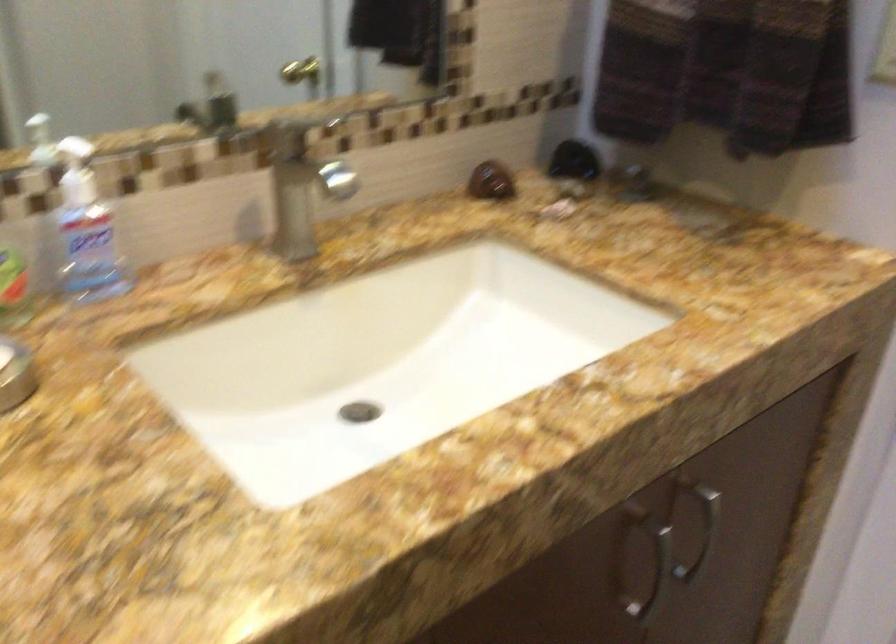
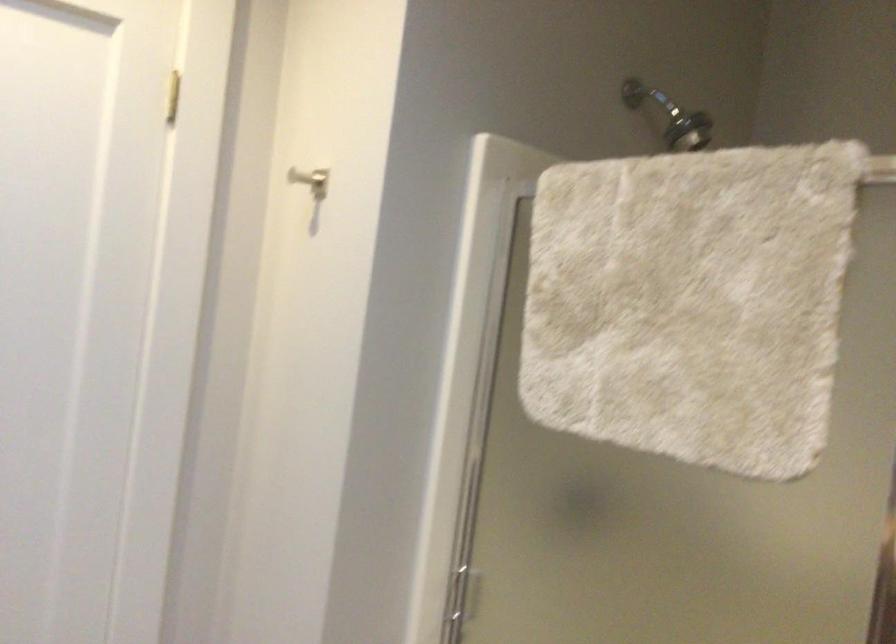
Question: The camera is either moving clockwise (left) or counter-clockwise (right) around the object. The first image is from the beginning of the video and the second image is from the end. Is the camera moving left or right when shooting the video?

Choices:
 (A) Left
 (B) Right

Answer: (A)